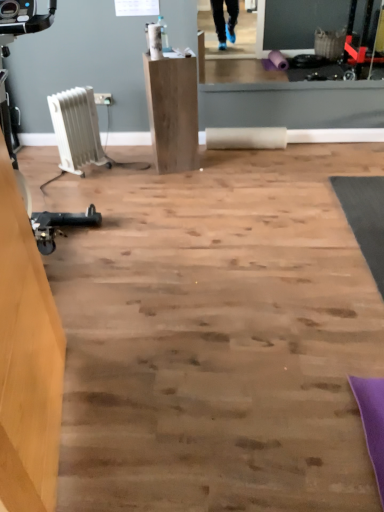
This screenshot has height=512, width=384. I want to click on vacant space in front of natural wood pedestal at center, the 1th furniture viewed from the back, so click(x=174, y=182).